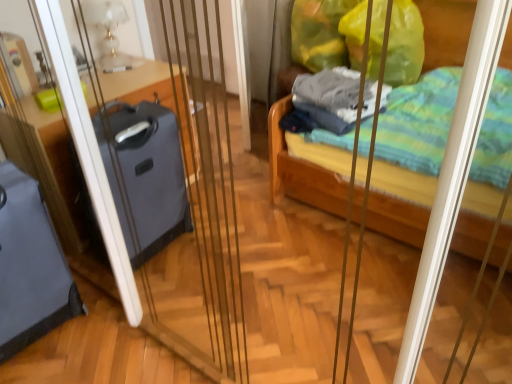
Locate an element on the screen. The width and height of the screenshot is (512, 384). spots to the right of matte gray suitcase at left is located at coordinates (105, 312).